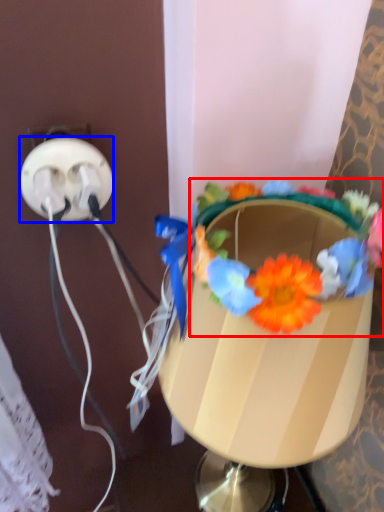
Question: Which of the following is the farthest to the observer, flower (highlighted by a red box) or power plugs and sockets (highlighted by a blue box)?

Choices:
 (A) flower
 (B) power plugs and sockets

Answer: (B)